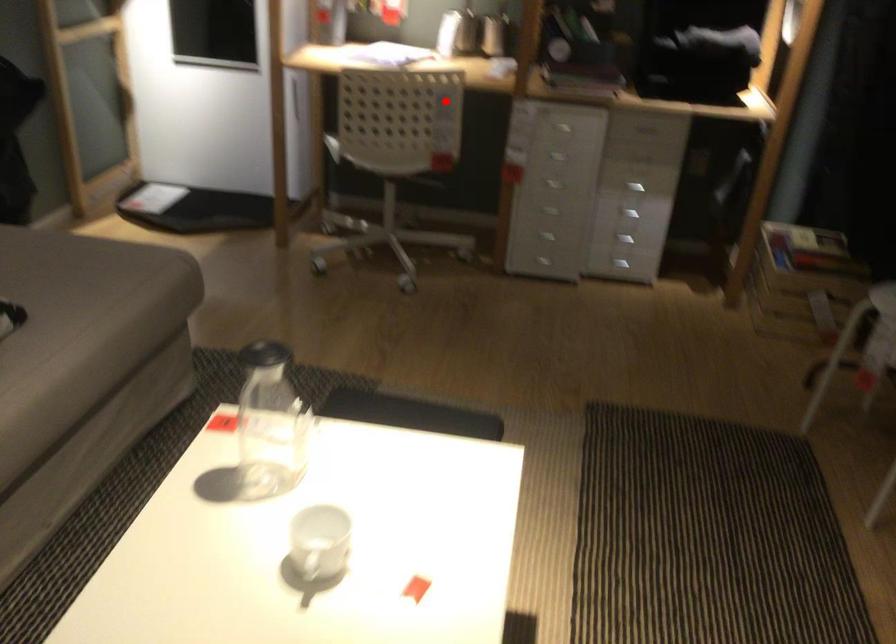
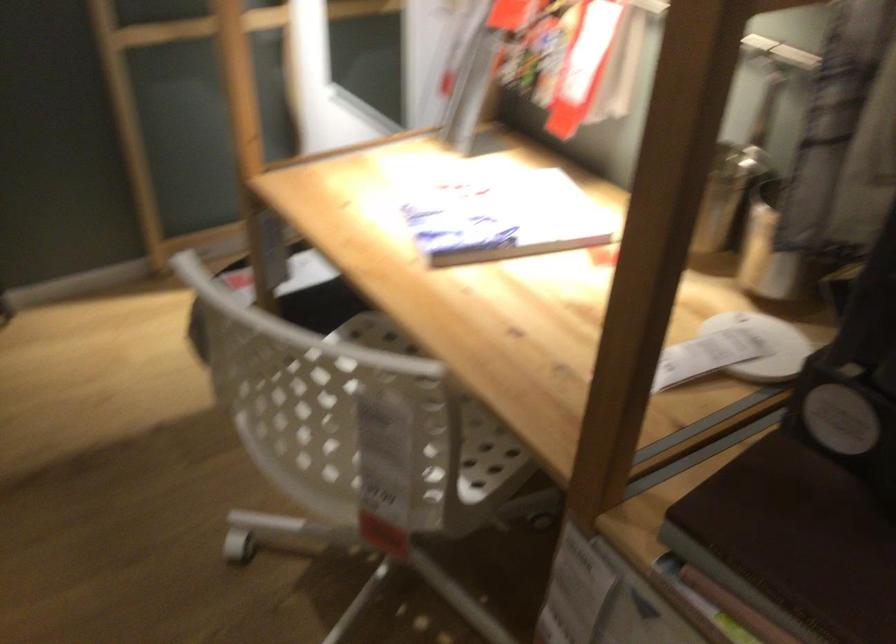
Find the pixel in the second image that matches the highlighted location in the first image.

(371, 418)